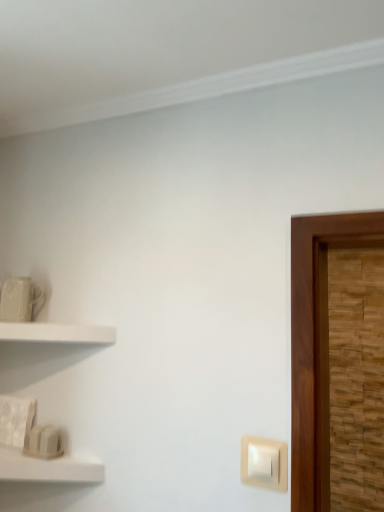
Question: Is white matte shelf at lower left, the 2th shelf in the top-to-bottom sequence, thinner than white matte shelf at left, which appears as the first shelf when viewed from the top?

Choices:
 (A) yes
 (B) no

Answer: (B)

Question: Is white matte shelf at lower left, the 2th shelf in the top-to-bottom sequence, positioned with its back to white matte shelf at left, which appears as the first shelf when viewed from the top?

Choices:
 (A) no
 (B) yes

Answer: (A)

Question: Is white matte shelf at lower left, the 2th shelf in the top-to-bottom sequence, closer to the viewer compared to white matte shelf at left, which is the second shelf in bottom-to-top order?

Choices:
 (A) yes
 (B) no

Answer: (A)

Question: From a real-world perspective, is white matte shelf at lower left, which ranks as the 1th shelf in bottom-to-top order, on top of white matte shelf at left, which is the second shelf in bottom-to-top order?

Choices:
 (A) no
 (B) yes

Answer: (A)

Question: Does white matte shelf at lower left, the 2th shelf in the top-to-bottom sequence, have a greater height compared to white matte shelf at left, which is the second shelf in bottom-to-top order?

Choices:
 (A) no
 (B) yes

Answer: (A)

Question: Is white matte shelf at lower left, the 2th shelf in the top-to-bottom sequence, bigger than white matte shelf at left, which appears as the first shelf when viewed from the top?

Choices:
 (A) no
 (B) yes

Answer: (A)

Question: From the image's perspective, does beige plastic light switch at lower right appear higher than white matte shelf at lower left, which ranks as the 1th shelf in bottom-to-top order?

Choices:
 (A) no
 (B) yes

Answer: (B)

Question: Is beige plastic light switch at lower right facing towards white matte shelf at lower left, the 2th shelf in the top-to-bottom sequence?

Choices:
 (A) no
 (B) yes

Answer: (A)

Question: Does beige plastic light switch at lower right have a greater width compared to white matte shelf at lower left, the 2th shelf in the top-to-bottom sequence?

Choices:
 (A) no
 (B) yes

Answer: (A)

Question: Is beige plastic light switch at lower right bigger than white matte shelf at lower left, the 2th shelf in the top-to-bottom sequence?

Choices:
 (A) no
 (B) yes

Answer: (A)

Question: Is the position of beige plastic light switch at lower right more distant than that of white matte shelf at lower left, the 2th shelf in the top-to-bottom sequence?

Choices:
 (A) no
 (B) yes

Answer: (B)

Question: From a real-world perspective, is beige plastic light switch at lower right under white matte shelf at lower left, which ranks as the 1th shelf in bottom-to-top order?

Choices:
 (A) no
 (B) yes

Answer: (A)

Question: Could you tell me if white matte shelf at left, which is the second shelf in bottom-to-top order, is facing beige plastic light switch at lower right?

Choices:
 (A) no
 (B) yes

Answer: (A)